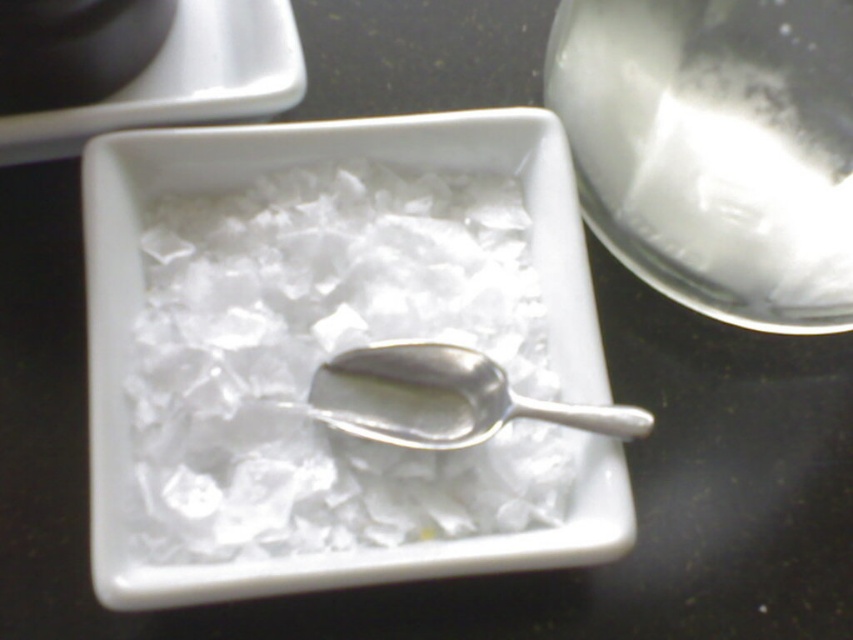
Question: Which point is farther from the camera taking this photo?

Choices:
 (A) (454, 460)
 (B) (790, 38)

Answer: (A)

Question: Is transparent glass bowl at upper right to the left of silver metallic spoon at center from the viewer's perspective?

Choices:
 (A) no
 (B) yes

Answer: (A)

Question: Considering the real-world distances, which object is farthest from the clear ice cubes at center?

Choices:
 (A) silver metallic spoon at center
 (B) transparent glass bowl at upper right

Answer: (B)

Question: Is clear ice cubes at center to the left of transparent glass bowl at upper right from the viewer's perspective?

Choices:
 (A) no
 (B) yes

Answer: (B)

Question: Does clear ice cubes at center appear over transparent glass bowl at upper right?

Choices:
 (A) no
 (B) yes

Answer: (A)

Question: Which of the following is the farthest from the observer?

Choices:
 (A) transparent glass bowl at upper right
 (B) silver metallic spoon at center
 (C) clear ice cubes at center

Answer: (B)